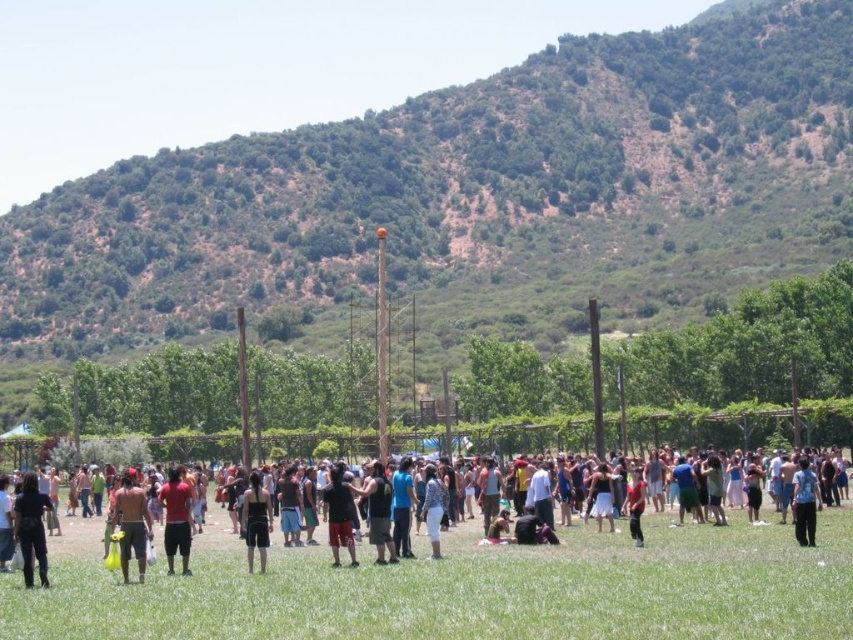
Is point (138, 528) closer to viewer compared to point (171, 496)?

Yes.

Locate an element on the screen. shiny metallic shorts at center is located at coordinates (131, 524).

The width and height of the screenshot is (853, 640). I want to click on shiny metallic shorts at center, so click(x=131, y=524).

Is the position of shiny metallic shorts at center less distant than that of white cotton pants at center?

Yes, it is in front of white cotton pants at center.

Which of these two, shiny metallic shorts at center or white cotton pants at center, stands shorter?

shiny metallic shorts at center is shorter.

Image resolution: width=853 pixels, height=640 pixels. Describe the element at coordinates (131, 524) in the screenshot. I see `shiny metallic shorts at center` at that location.

What are the coordinates of `shiny metallic shorts at center` in the screenshot? It's located at (131, 524).

The height and width of the screenshot is (640, 853). What do you see at coordinates (131, 524) in the screenshot?
I see `shiny metallic shorts at center` at bounding box center [131, 524].

Can you confirm if shiny metallic shorts at center is smaller than black matte shirt at center?

No.

Between point (131, 497) and point (346, 488), which one is positioned behind?

The point (346, 488) is behind.

I want to click on shiny metallic shorts at center, so click(131, 524).